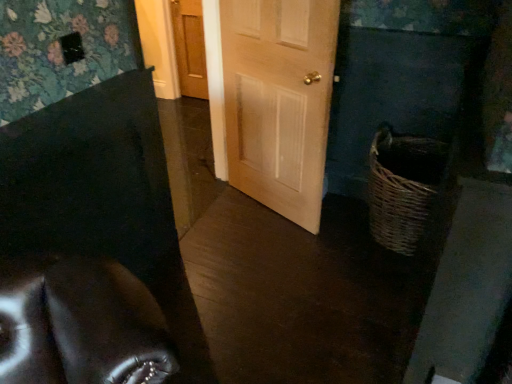
You are a GUI agent. You are given a task and a screenshot of the screen. Output one action in this format:
    pyautogui.click(x=<x>, y=<y>)
    Task: Click on the vacant area that lies in front of light wood door at center, which is the 1th door from front to back
    The image size is (512, 384).
    Given the screenshot: What is the action you would take?
    pyautogui.click(x=272, y=259)